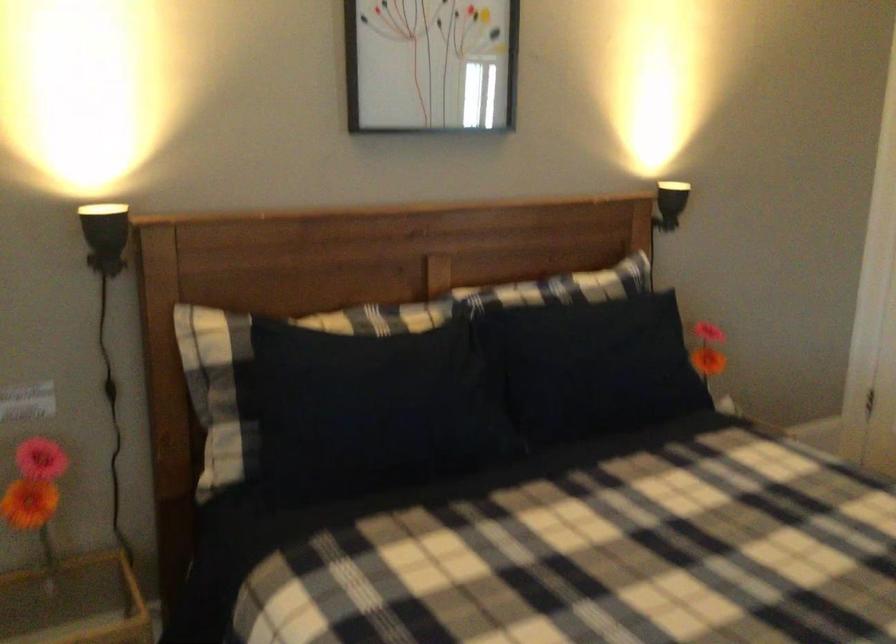
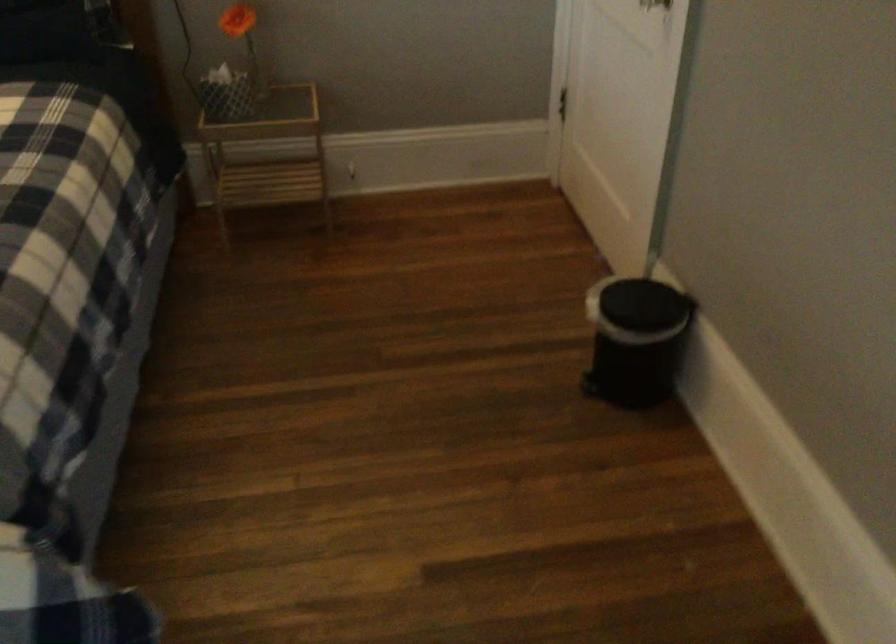
Question: The images are taken continuously from a first-person perspective. In which direction are you moving?

Choices:
 (A) Left
 (B) Right
 (C) Forward
 (D) Backward

Answer: (B)